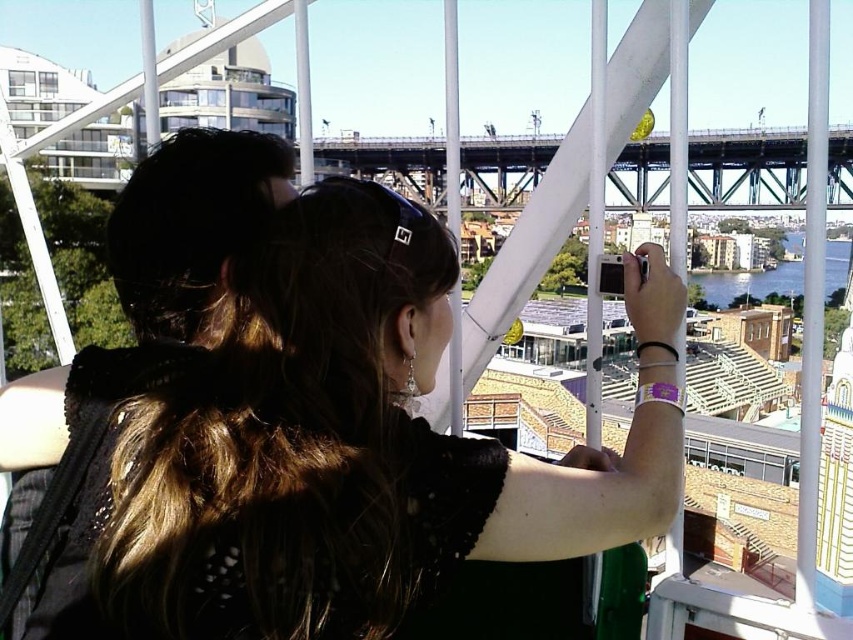
Question: Can you confirm if black lace dress at center is bigger than metallic gray bridge at center?

Choices:
 (A) yes
 (B) no

Answer: (B)

Question: Can you confirm if black lace dress at center is thinner than metallic gray bridge at center?

Choices:
 (A) no
 (B) yes

Answer: (B)

Question: Which object appears farthest from the camera in this image?

Choices:
 (A) metallic gray bridge at center
 (B) black lace dress at center

Answer: (A)

Question: Is black lace dress at center thinner than metallic gray bridge at center?

Choices:
 (A) yes
 (B) no

Answer: (A)

Question: Which point appears closest to the camera in this image?

Choices:
 (A) (468, 160)
 (B) (480, 540)

Answer: (B)